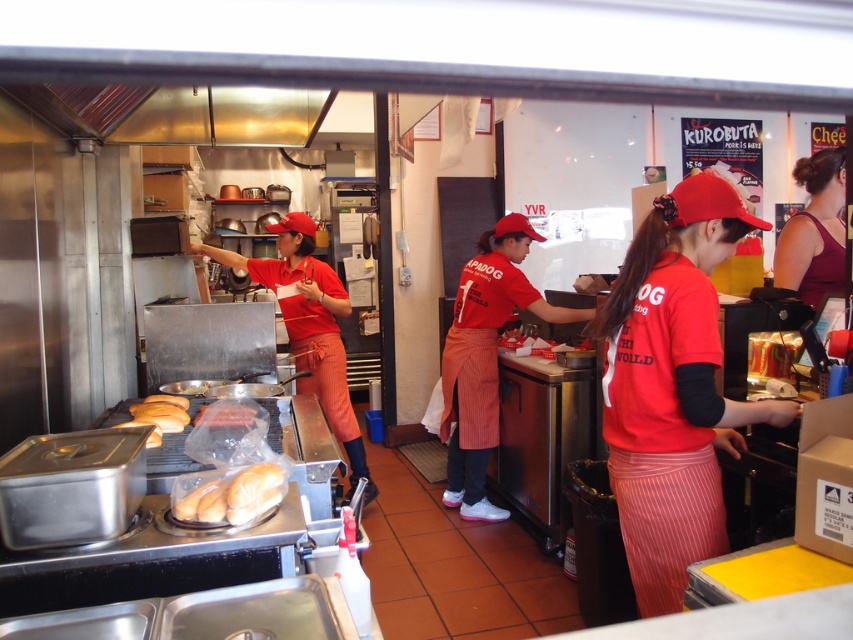
Question: Can you confirm if dark red fabric dress at right is positioned to the right of golden bread at left?

Choices:
 (A) no
 (B) yes

Answer: (B)

Question: Which point is farther to the camera?

Choices:
 (A) dark red fabric dress at right
 (B) matte red uniform at center
 (C) matte red cap at center
 (D) translucent plastic baguette at center

Answer: (B)

Question: Is matte red cap at center to the right of dark red fabric dress at right from the viewer's perspective?

Choices:
 (A) yes
 (B) no

Answer: (B)

Question: Can you confirm if matte red cap at center is positioned to the right of golden bread at left?

Choices:
 (A) no
 (B) yes

Answer: (B)

Question: Which object appears farthest from the camera in this image?

Choices:
 (A) white matte bread at lower left
 (B) golden bread at left

Answer: (B)

Question: Among these points, which one is nearest to the camera?

Choices:
 (A) (811, 262)
 (B) (271, 493)

Answer: (B)